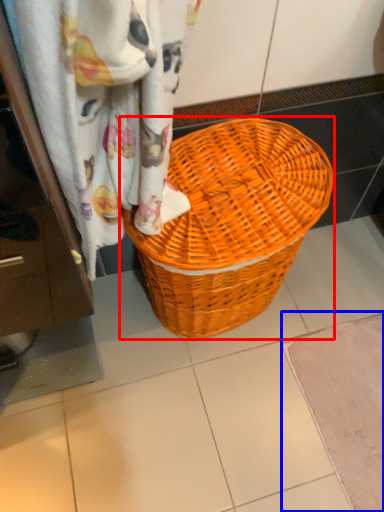
Question: Among these objects, which one is farthest to the camera, picnic basket (highlighted by a red box) or bath mat (highlighted by a blue box)?

Choices:
 (A) picnic basket
 (B) bath mat

Answer: (B)